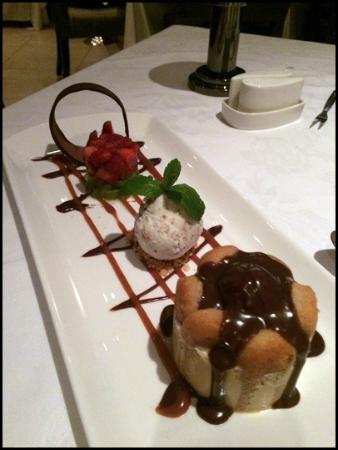
Locate an element on the screen. This screenshot has width=338, height=450. plate is located at coordinates (310, 400), (103, 336).